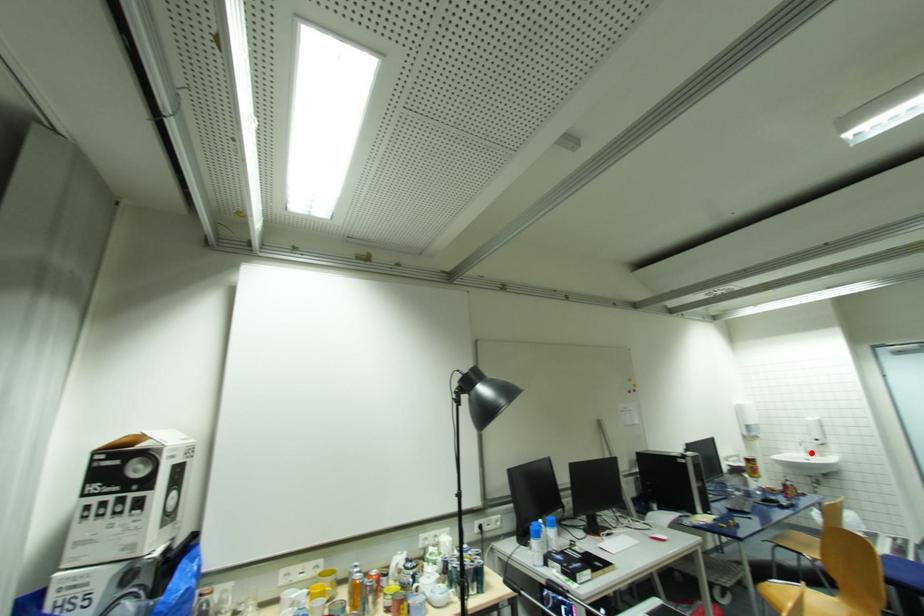
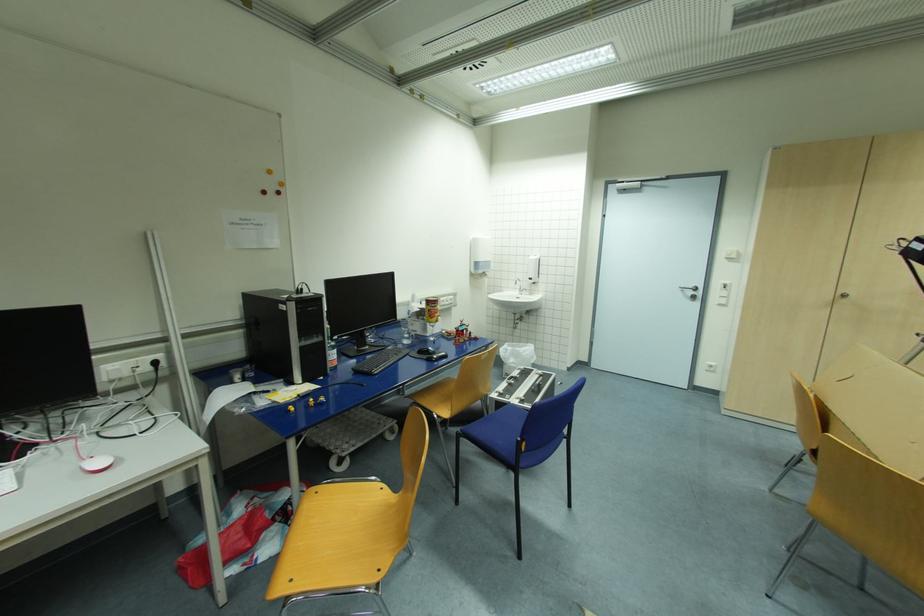
Question: A red point is marked in image1. In image2, is the corresponding 3D point closer to the camera or farther? Reply with the corresponding letter.

Choices:
 (A) The corresponding 3D point is closer.
 (B) The corresponding 3D point is farther.

Answer: (B)